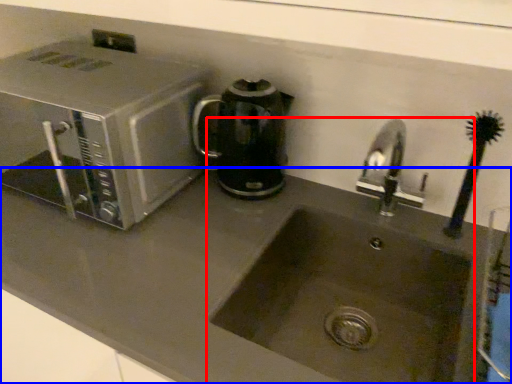
Question: Which object is further to the camera taking this photo, sink (highlighted by a red box) or counter top (highlighted by a blue box)?

Choices:
 (A) sink
 (B) counter top

Answer: (A)